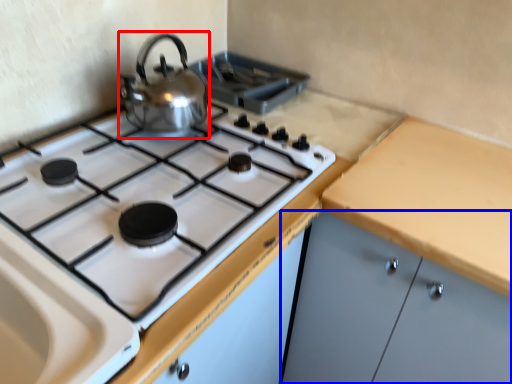
Question: Which object is further to the camera taking this photo, kitchen appliance (highlighted by a red box) or cabinetry (highlighted by a blue box)?

Choices:
 (A) kitchen appliance
 (B) cabinetry

Answer: (A)